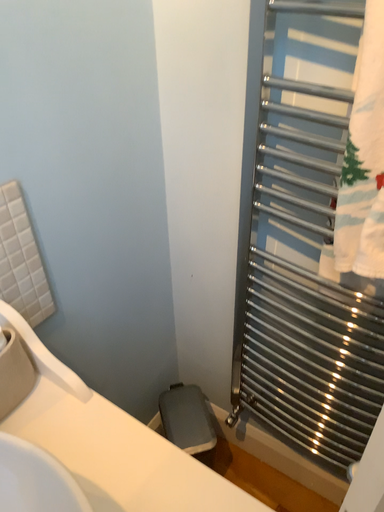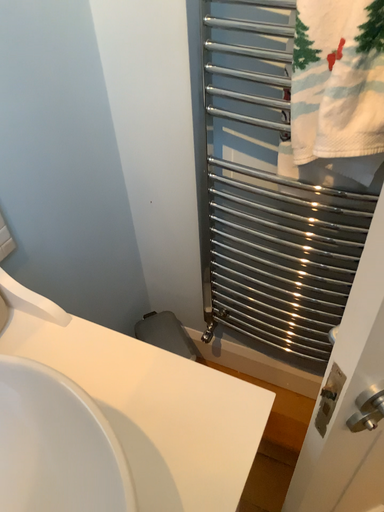
Question: Which way did the camera rotate in the video?

Choices:
 (A) rotated right
 (B) rotated left

Answer: (A)